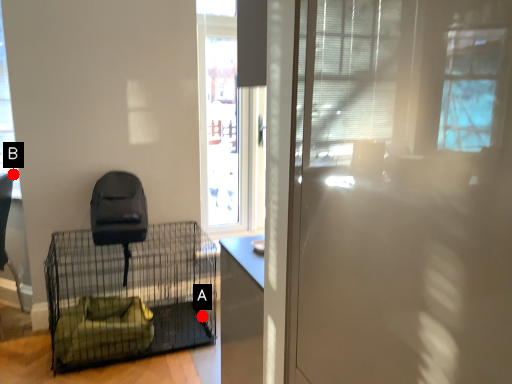
Question: Two points are circled on the image, labeled by A and B beside each circle. Which of the following is the closest to the observer?

Choices:
 (A) A is closer
 (B) B is closer

Answer: (B)